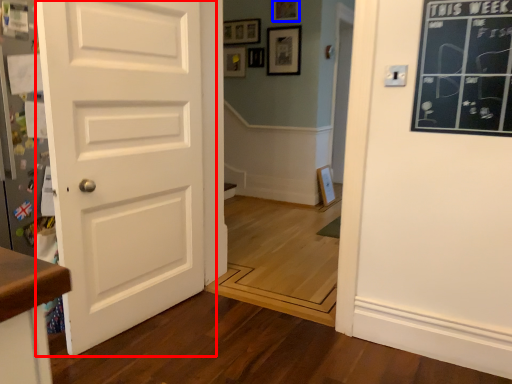
Question: Which point is further to the camera, door (highlighted by a red box) or picture frame (highlighted by a blue box)?

Choices:
 (A) door
 (B) picture frame

Answer: (B)